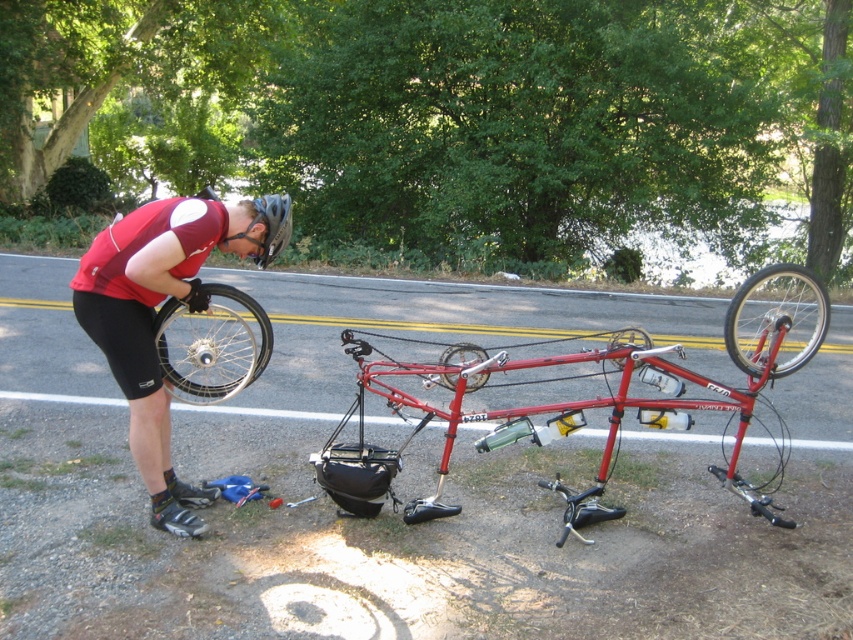
Is shiny silver rim at left taller than matte black tire at center?

Yes.

Locate an element on the screen. The height and width of the screenshot is (640, 853). shiny silver rim at left is located at coordinates (212, 346).

How distant is black matte helmet at center from matte black tire at center?

They are 6.04 meters apart.

Does point (268, 204) come in front of point (639, 348)?

Yes.

Does point (279, 243) lie behind point (621, 348)?

No, it is in front of (621, 348).

The image size is (853, 640). Identify the location of black matte helmet at center. (271, 225).

Does black matte helmet at center appear over metallic silver wheel at center?

Indeed, black matte helmet at center is positioned over metallic silver wheel at center.

Can you confirm if black matte helmet at center is wider than metallic silver wheel at center?

Yes, black matte helmet at center is wider than metallic silver wheel at center.

From the picture: Measure the distance between point (268, 253) and camera.

The distance of point (268, 253) from camera is 4.37 meters.

Identify the location of black matte helmet at center. (271, 225).